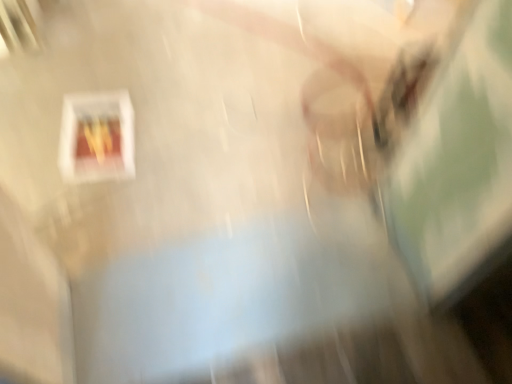
This screenshot has width=512, height=384. I want to click on free space above matte wooden picture frame at lower left (from a real-world perspective), so click(x=102, y=138).